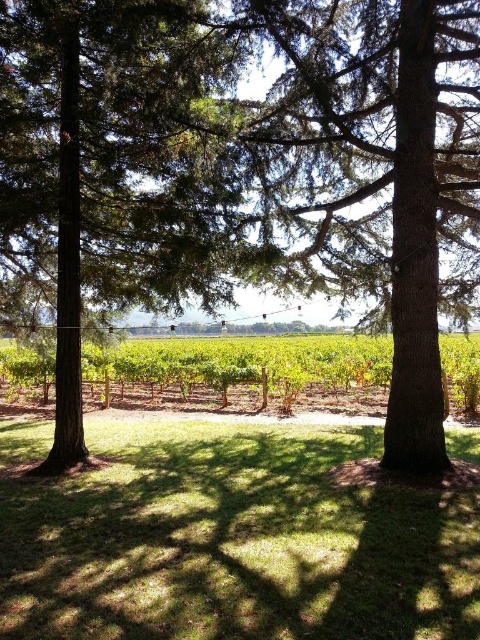
You are standing at the camera position in the vineyard scene. There is a point at coordinates point (216, 424). If you want to walk directly to that point, how far will you have to walk?

The distance of point (216, 424) from camera is 9.48 meters, so you will have to walk 9.48 meters to reach that point.

You are a gardener standing at the edge of the vineyard looking towards the center. You notice both the green grass at center and the green textured tree at center. Which one is closer to you?

The green grass at center is closer to you because it is in front of the green textured tree at center.

You are standing in the vineyard and see the green grass at center and the green textured tree at center. Which object is located to the right of the other?

The green grass at center is to the right of the green textured tree at center.